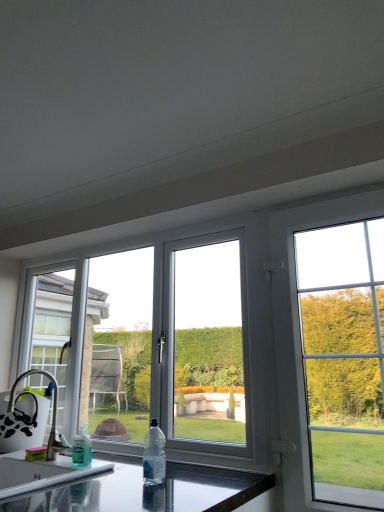
Question: Does clear plastic bottle at center, placed as the first bottle when sorted from right to left, lie behind clear plastic bottle at lower left, the second bottle positioned from the right?

Choices:
 (A) no
 (B) yes

Answer: (A)

Question: Is clear plastic bottle at center, arranged as the second bottle when viewed from the left, oriented away from clear plastic bottle at lower left, the first bottle positioned from the back?

Choices:
 (A) no
 (B) yes

Answer: (A)

Question: Is clear plastic bottle at center, the 2th bottle when ordered from back to front, facing towards clear plastic bottle at lower left, the second bottle viewed from the front?

Choices:
 (A) no
 (B) yes

Answer: (A)

Question: Is clear plastic bottle at center, the 2th bottle when ordered from back to front, positioned beyond the bounds of clear plastic bottle at lower left, positioned as the 1th bottle in left-to-right order?

Choices:
 (A) yes
 (B) no

Answer: (A)

Question: From a real-world perspective, is clear plastic bottle at center, the 1th bottle from the front, over clear plastic bottle at lower left, positioned as the 1th bottle in left-to-right order?

Choices:
 (A) no
 (B) yes

Answer: (B)

Question: Does point (74, 437) appear closer or farther from the camera than point (349, 266)?

Choices:
 (A) closer
 (B) farther

Answer: (B)

Question: Is clear plastic bottle at lower left, the second bottle viewed from the front, to the left or to the right of white plastic window at upper right, which appears as the second window when viewed from the left, in the image?

Choices:
 (A) right
 (B) left

Answer: (B)

Question: Looking at the image, does clear plastic bottle at lower left, positioned as the 1th bottle in left-to-right order, seem bigger or smaller compared to white plastic window at upper right, the 1th window from the right?

Choices:
 (A) big
 (B) small

Answer: (B)

Question: Is clear plastic bottle at lower left, the second bottle viewed from the front, in front of or behind white plastic window at upper right, the 1th window from the right, in the image?

Choices:
 (A) behind
 (B) front

Answer: (A)

Question: In the image, is white plastic window at center, positioned as the 1th window in left-to-right order, on the left side or the right side of black glossy countertop at lower center?

Choices:
 (A) right
 (B) left

Answer: (A)

Question: From a real-world perspective, relative to black glossy countertop at lower center, is white plastic window at center, the second window positioned from the right, vertically above or below?

Choices:
 (A) above
 (B) below

Answer: (A)

Question: From the image's perspective, is white plastic window at center, the second window positioned from the right, located above or below black glossy countertop at lower center?

Choices:
 (A) above
 (B) below

Answer: (A)

Question: Is white plastic window at center, positioned as the 1th window in left-to-right order, bigger or smaller than black glossy countertop at lower center?

Choices:
 (A) small
 (B) big

Answer: (A)

Question: Is white plastic window at upper right, the 1th window from the right, wider or thinner than black glossy countertop at lower center?

Choices:
 (A) wide
 (B) thin

Answer: (B)

Question: Is white plastic window at upper right, the 1th window from the right, in front of or behind black glossy countertop at lower center in the image?

Choices:
 (A) behind
 (B) front

Answer: (A)